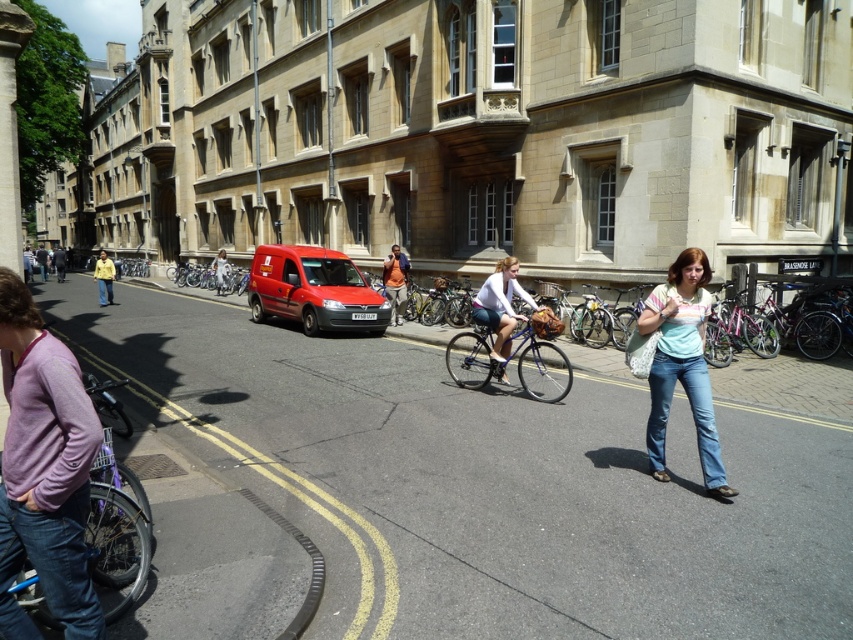
Is point (703, 275) closer to viewer compared to point (109, 275)?

Yes, point (703, 275) is closer to viewer.

Can you confirm if light blue denim jeans at center is bigger than yellow fabric jacket at center?

No.

Which is behind, point (701, 259) or point (106, 266)?

The point (106, 266) is behind.

Locate an element on the screen. light blue denim jeans at center is located at coordinates (682, 365).

This screenshot has height=640, width=853. Describe the element at coordinates (312, 289) in the screenshot. I see `matte red van at center` at that location.

Is matte red van at center positioned in front of light blue jeans at center?

Yes, matte red van at center is in front of light blue jeans at center.

Is point (335, 288) farther from viewer compared to point (212, 260)?

No, (335, 288) is closer to viewer.

Find the location of `matte red van at center`. matte red van at center is located at coordinates (312, 289).

Is purple matte bicycle at lower left wider than matte red van at center?

No.

What do you see at coordinates (115, 532) in the screenshot?
I see `purple matte bicycle at lower left` at bounding box center [115, 532].

Measure the distance between purple matte bicycle at lower left and camera.

9.30 feet

At what (x,y) coordinates should I click in order to perform the action: click on purple matte bicycle at lower left. Please return your answer as a coordinate pair (x, y). The width and height of the screenshot is (853, 640). Looking at the image, I should click on (115, 532).